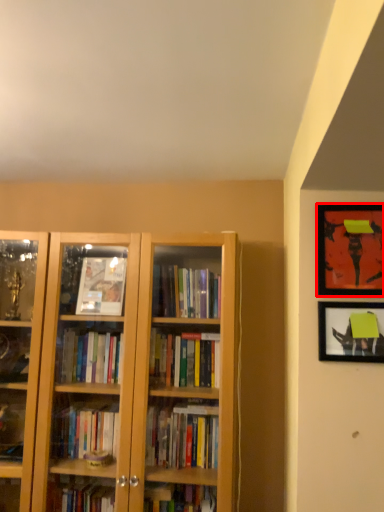
Question: Where is picture frame (annotated by the red box) located in relation to picture frame in the image?

Choices:
 (A) left
 (B) right

Answer: (B)